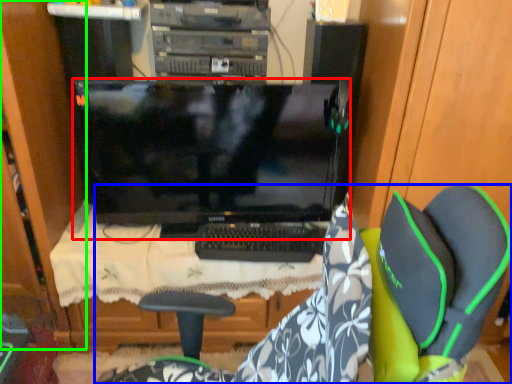
Question: Which is nearer to the computer monitor (highlighted by a red box)? chair (highlighted by a blue box) or dresser (highlighted by a green box).

Choices:
 (A) chair
 (B) dresser

Answer: (B)